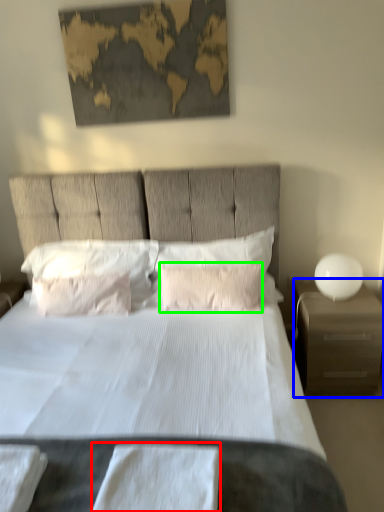
Question: Based on their relative distances, which object is farther from sheet (highlighted by a red box)? Choose from nightstand (highlighted by a blue box) and pillow (highlighted by a green box).

Choices:
 (A) nightstand
 (B) pillow

Answer: (A)